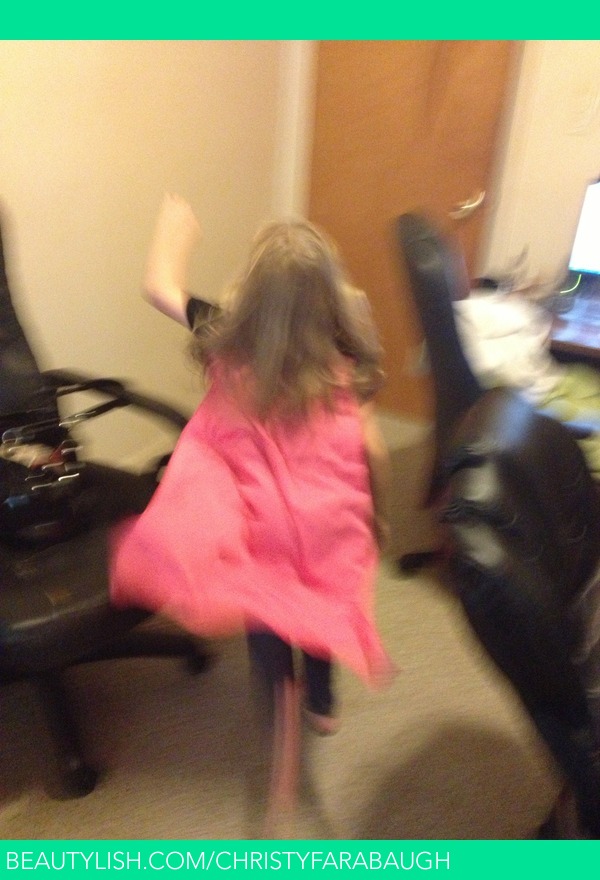
Where is `blurry gold door handle`? This screenshot has height=880, width=600. blurry gold door handle is located at coordinates (471, 207).